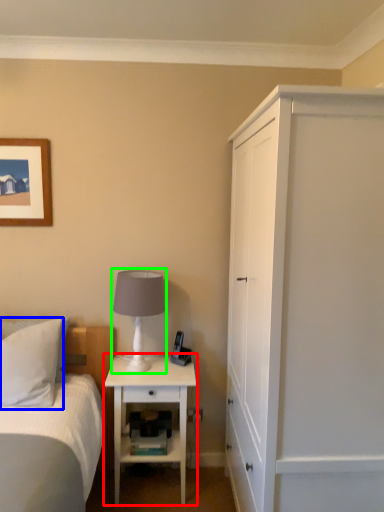
Question: Which object is positioned farthest from nightstand (highlighted by a red box)? Select from pillow (highlighted by a blue box) and table lamp (highlighted by a green box).

Choices:
 (A) pillow
 (B) table lamp

Answer: (A)